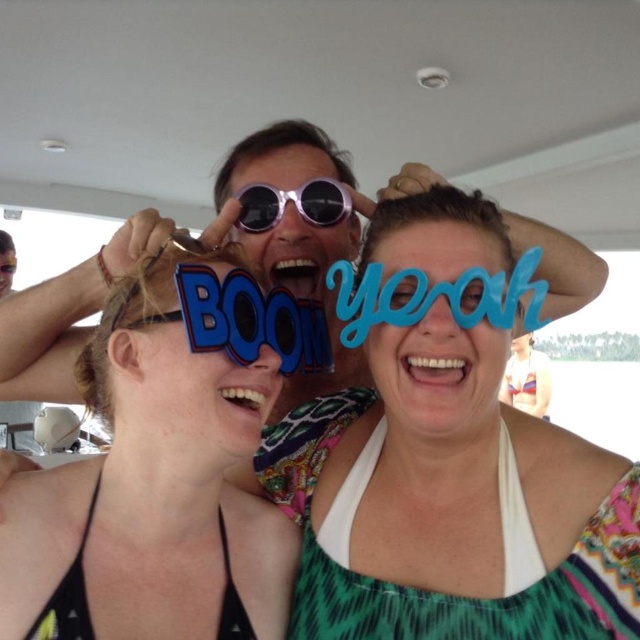
Who is more forward, (442, 608) or (248, 193)?

Point (442, 608) is more forward.

Is point (404, 326) farther from viewer compared to point (300, 209)?

No.

Does point (449, 259) come farther from viewer compared to point (257, 232)?

No.

Identify the location of blue paper sign at center. tap(451, 502).

Is blue paper sign at center further to camera compared to matte plastic sunglasses at center?

No, it is in front of matte plastic sunglasses at center.

Does point (552, 512) come closer to viewer compared to point (157, 419)?

No, it is behind (157, 419).

Identify the location of blue paper sign at center. (451, 502).

Is matte plastic sunglasses at center taller than sunglasses at center?

Indeed, matte plastic sunglasses at center has a greater height compared to sunglasses at center.

Does matte plastic sunglasses at center appear on the right side of sunglasses at center?

Incorrect, matte plastic sunglasses at center is not on the right side of sunglasses at center.

Is point (204, 412) closer to camera compared to point (310, 192)?

Yes.

The height and width of the screenshot is (640, 640). In order to click on matte plastic sunglasses at center in this screenshot , I will do `click(152, 493)`.